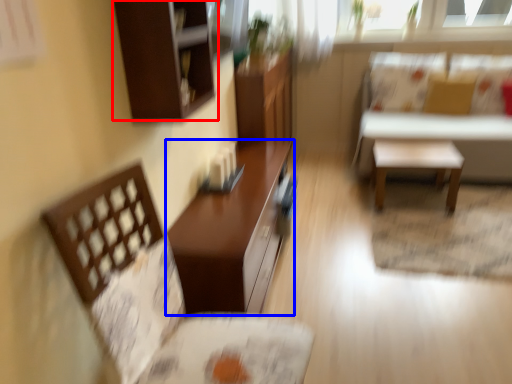
Question: Which object appears closest to the camera in this image, cabinetry (highlighted by a red box) or table (highlighted by a blue box)?

Choices:
 (A) cabinetry
 (B) table

Answer: (A)